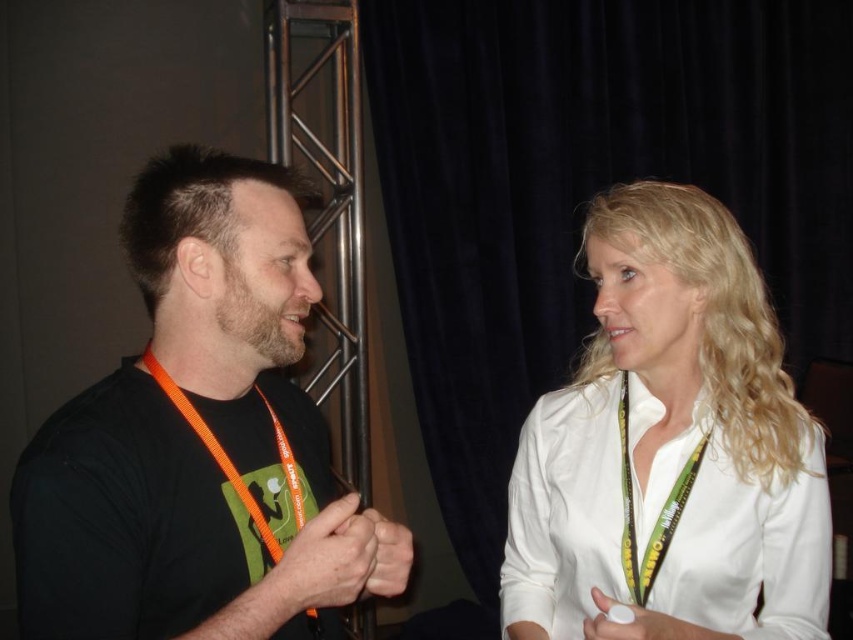
Who is lower down, white smooth shirt at upper right or orange nylon lanyard at left?

Positioned lower is orange nylon lanyard at left.

Is point (524, 465) closer to viewer compared to point (242, 486)?

No, (524, 465) is behind (242, 486).

Where is `white smooth shirt at upper right`? This screenshot has height=640, width=853. white smooth shirt at upper right is located at coordinates (670, 448).

Locate an element on the screen. This screenshot has width=853, height=640. black matte t-shirt at left is located at coordinates (199, 440).

Which is behind, point (169, 292) or point (706, 317)?

Positioned behind is point (706, 317).

The width and height of the screenshot is (853, 640). Identify the location of black matte t-shirt at left. (199, 440).

Is green fabric lanyard at center positioned behind orange nylon lanyard at left?

Yes, it is behind orange nylon lanyard at left.

Does green fabric lanyard at center have a greater width compared to orange nylon lanyard at left?

In fact, green fabric lanyard at center might be narrower than orange nylon lanyard at left.

Is point (631, 586) closer to viewer compared to point (277, 445)?

That is False.

Find the location of a particular element. The width and height of the screenshot is (853, 640). green fabric lanyard at center is located at coordinates (659, 515).